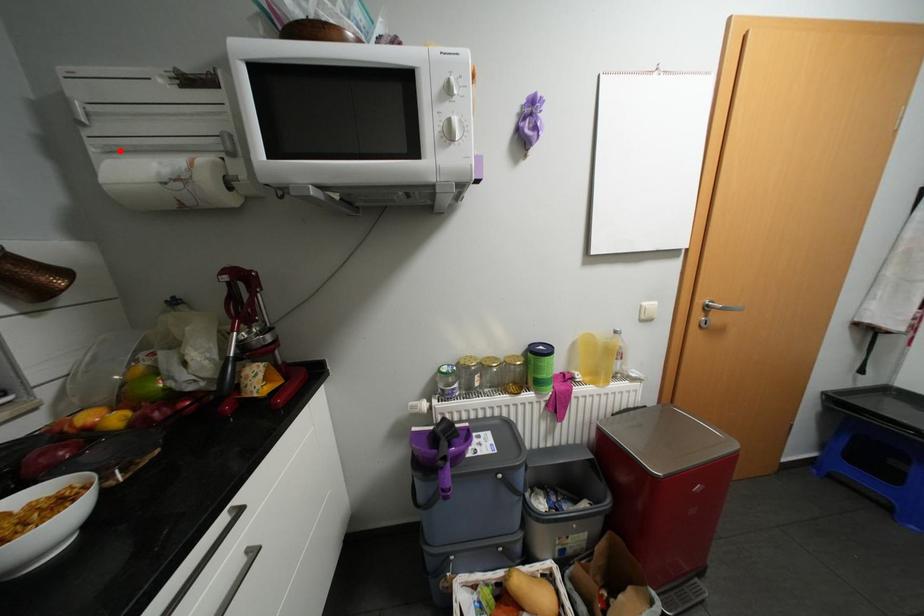
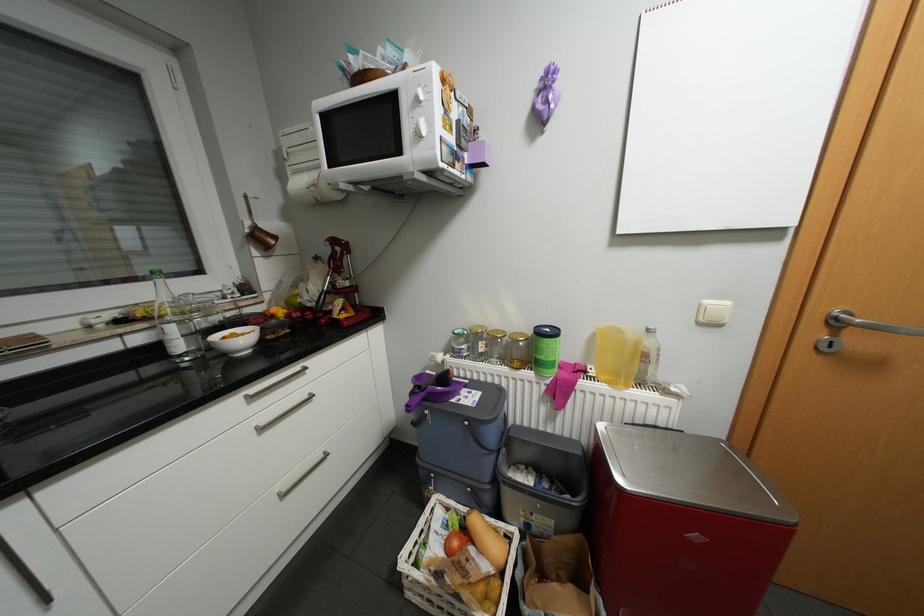
In the second image, find the point that corresponds to the highlighted location in the first image.

(302, 172)